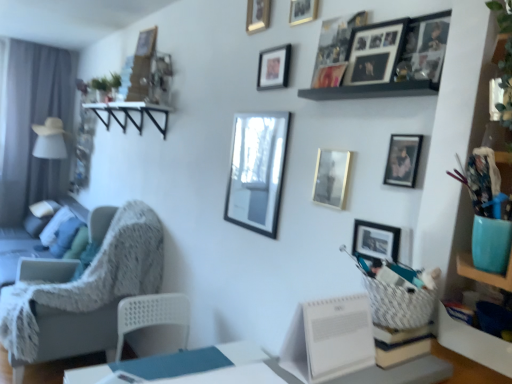
Question: Is textured gray chair at left inside the boundaries of metallic gold picture frame at upper center, which is the seventh picture frame from bottom to top, or outside?

Choices:
 (A) inside
 (B) outside

Answer: (B)

Question: Is textured gray chair at left to the left or to the right of metallic gold picture frame at upper center, which is the seventh picture frame from bottom to top, in the image?

Choices:
 (A) left
 (B) right

Answer: (A)

Question: Which of these objects is positioned closest to the black wooden shelf at upper center?

Choices:
 (A) gold metallic picture frame at upper center, which is counted as the 8th picture frame, starting from the top
 (B) textured gray chair at left
 (C) gold metallic picture frame at upper center, positioned as the 9th picture frame in bottom-to-top order
 (D) metallic silver picture frame at lower right, marked as the ninth picture frame in a top-to-bottom arrangement
 (E) gold metallic picture frame at upper right, the 3th picture frame positioned from the bottom

Answer: (E)

Question: Which object is positioned farthest from the black wooden shelf at upper center?

Choices:
 (A) textured gray couch at left
 (B) white plastic table at lower center
 (C) gold metallic picture frame at upper center, marked as the 2th picture frame in a top-to-bottom arrangement
 (D) metallic gold picture frame at upper center, which is the seventh picture frame from bottom to top
 (E) gold metallic picture frame at upper center, the 1th picture frame from the top

Answer: (A)